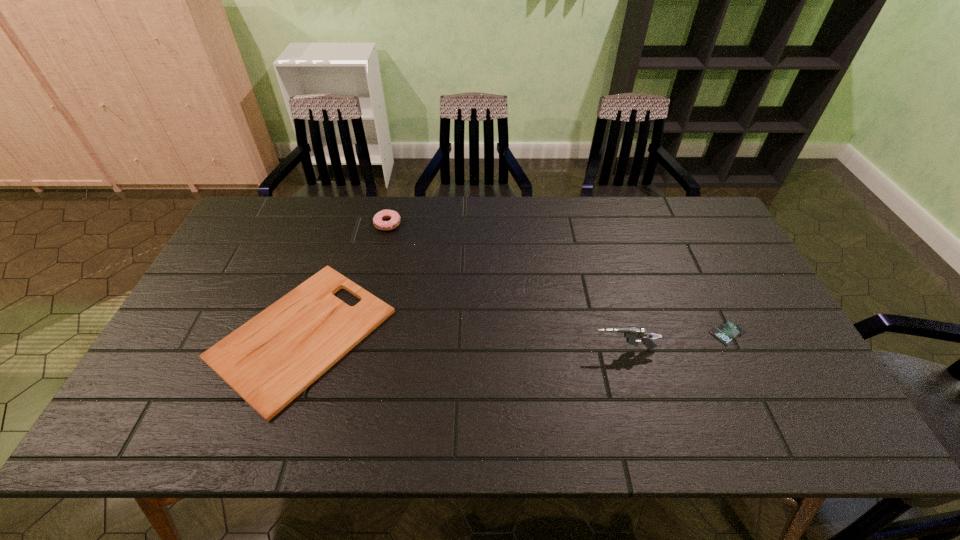
This screenshot has height=540, width=960. Identify the location of free location at the left edge of the desktop. (252, 260).

Identify the location of vacant space at the right edge of the desktop. (751, 306).

In the image, there is a desktop. What are the coordinates of `free region at the far right corner` in the screenshot? It's located at (696, 221).

Where is `free space that is in between the chopping board and the tallest object`? The image size is (960, 540). free space that is in between the chopping board and the tallest object is located at coordinates (463, 341).

Where is `empty space that is in between the doughnut and the tallest object`? This screenshot has height=540, width=960. empty space that is in between the doughnut and the tallest object is located at coordinates (506, 287).

The width and height of the screenshot is (960, 540). Find the location of `free spot between the tallest object and the identity card`. free spot between the tallest object and the identity card is located at coordinates (676, 341).

The image size is (960, 540). In order to click on vacant area between the gun and the chopping board in this screenshot , I will do click(463, 341).

Where is `vacant region between the doughnut and the identity card`? The image size is (960, 540). vacant region between the doughnut and the identity card is located at coordinates pyautogui.click(x=558, y=279).

Locate an element on the screen. free spot between the tallest object and the rightmost object is located at coordinates (676, 341).

I want to click on free space between the third object from left to right and the chopping board, so click(463, 341).